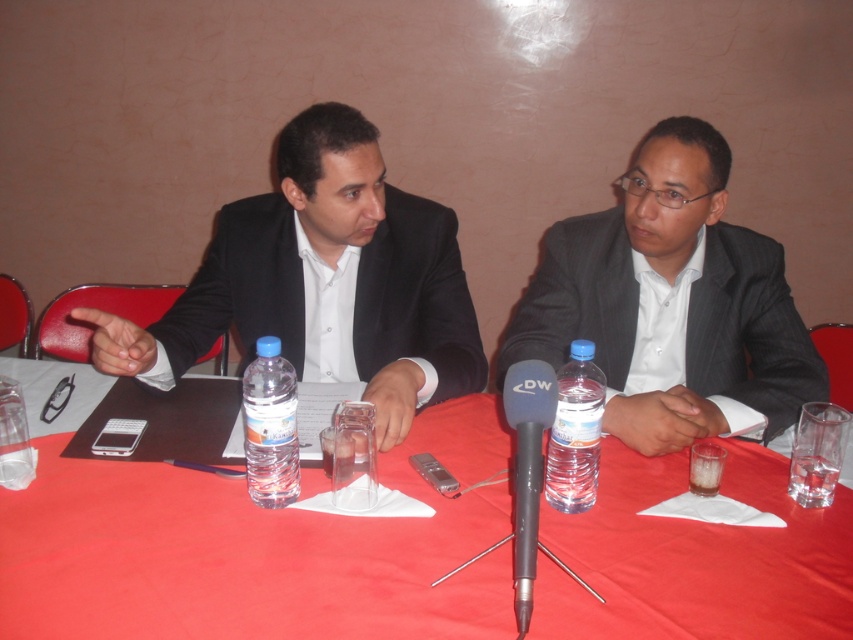
Question: Which object is the farthest from the clear plastic water bottle at center?

Choices:
 (A) clear plastic bottle at center
 (B) matte gray suit at center
 (C) black matte microphone at center

Answer: (A)

Question: Based on their relative distances, which object is nearer to the clear plastic bottle at center?

Choices:
 (A) matte gray suit at center
 (B) red cloth table at center
 (C) black matte microphone at center

Answer: (B)

Question: Which point appears closest to the camera in this image?

Choices:
 (A) (693, 220)
 (B) (550, 432)
 (C) (439, 621)
 (D) (283, 449)

Answer: (C)

Question: Is clear plastic bottle at center to the right of black matte microphone at center from the viewer's perspective?

Choices:
 (A) yes
 (B) no

Answer: (B)

Question: Can you confirm if black matte suit at left is wider than clear plastic water bottle at center?

Choices:
 (A) no
 (B) yes

Answer: (B)

Question: Does black matte suit at left have a larger size compared to black matte microphone at center?

Choices:
 (A) yes
 (B) no

Answer: (A)